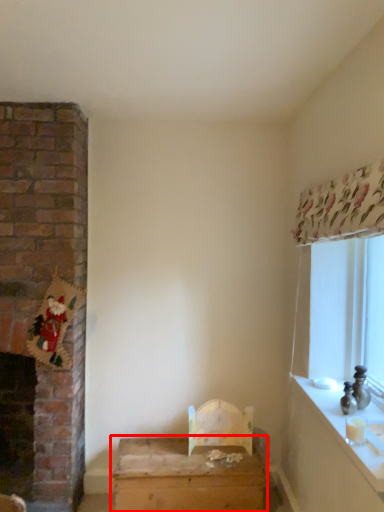
Question: Considering the relative positions of table (annotated by the red box) and counter top in the image provided, where is table (annotated by the red box) located with respect to the staircase?

Choices:
 (A) right
 (B) left

Answer: (B)